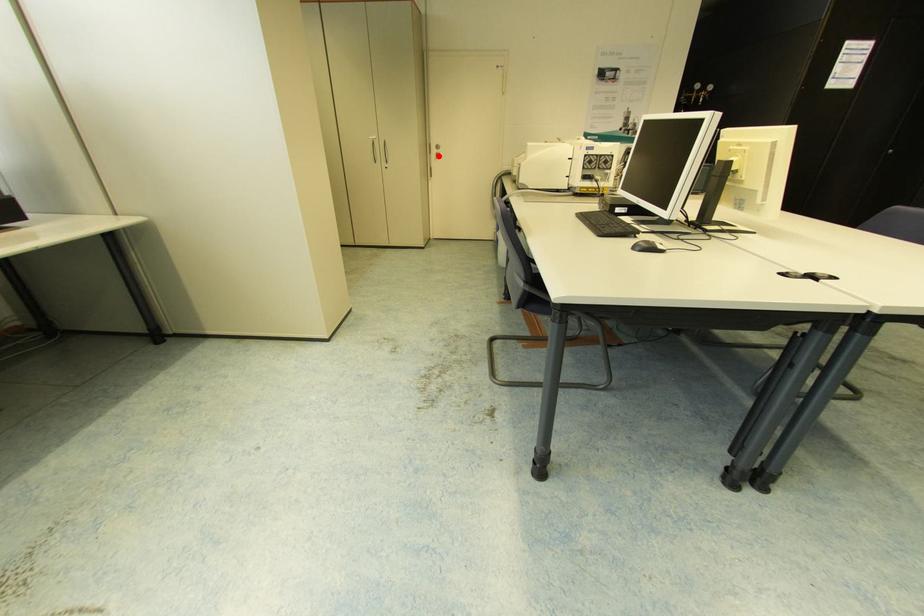
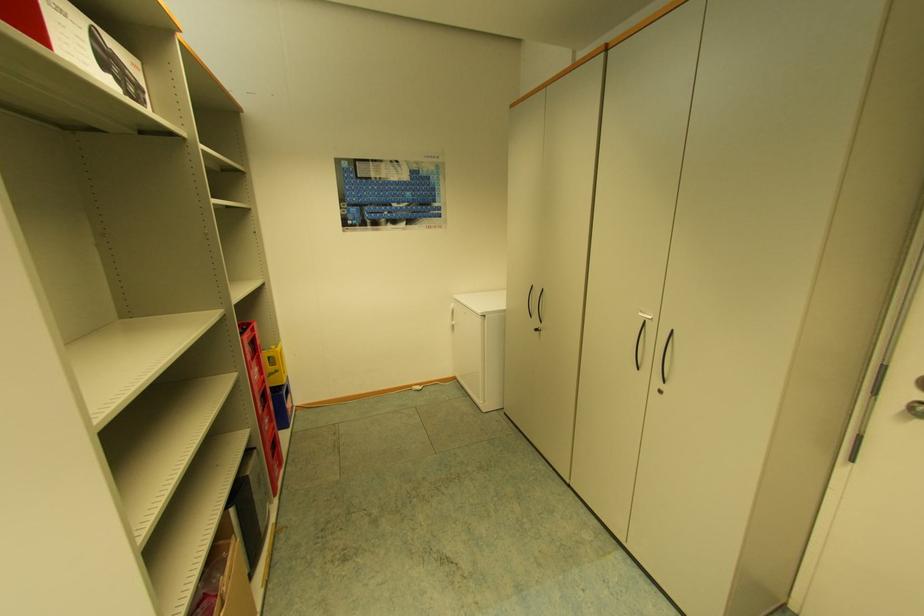
Find the pixel in the second image that matches the highlighted location in the first image.

(907, 408)